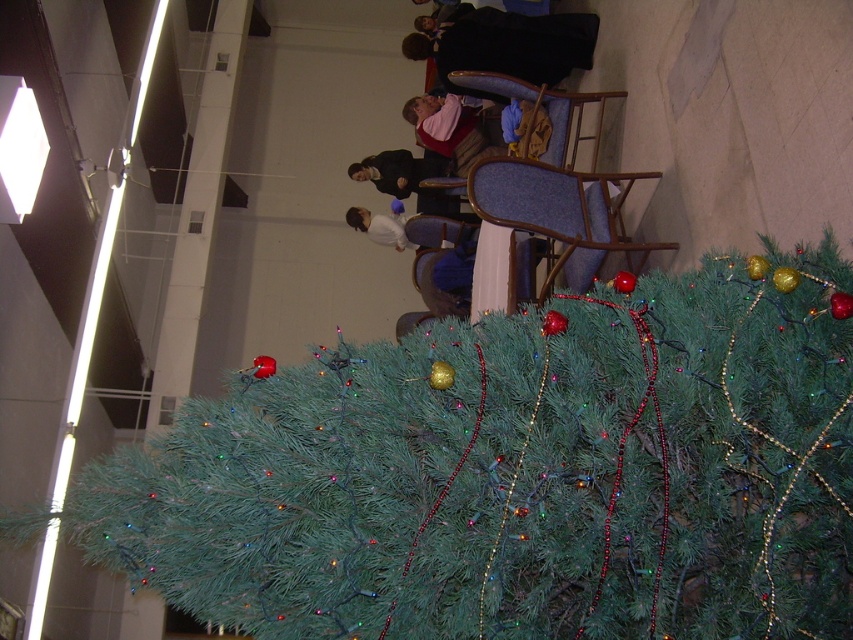
Who is higher up, green artificial christmas tree at center or white matte shirt at upper center?

white matte shirt at upper center is above.

Is green artificial christmas tree at center thinner than white matte shirt at upper center?

Incorrect, green artificial christmas tree at center's width is not less than white matte shirt at upper center's.

Who is more forward, (490, 396) or (352, 205)?

Point (490, 396) is in front.

Where is `green artificial christmas tree at center`? The width and height of the screenshot is (853, 640). green artificial christmas tree at center is located at coordinates (519, 474).

Who is positioned more to the right, pink fabric shirt at upper center or white matte shirt at upper center?

pink fabric shirt at upper center

Who is shorter, pink fabric shirt at upper center or white matte shirt at upper center?

With less height is white matte shirt at upper center.

Between point (430, 141) and point (366, 218), which one is positioned in front?

Point (430, 141) is in front.

The image size is (853, 640). In order to click on pink fabric shirt at upper center in this screenshot , I will do coord(444,122).

Who is positioned more to the right, green artificial christmas tree at center or pink fabric shirt at upper center?

green artificial christmas tree at center is more to the right.

Describe the element at coordinates (519, 474) in the screenshot. This screenshot has height=640, width=853. I see `green artificial christmas tree at center` at that location.

You are a GUI agent. You are given a task and a screenshot of the screen. Output one action in this format:
    pyautogui.click(x=<x>, y=<y>)
    Task: Click on the green artificial christmas tree at center
    Image resolution: width=853 pixels, height=640 pixels.
    Given the screenshot: What is the action you would take?
    pyautogui.click(x=519, y=474)